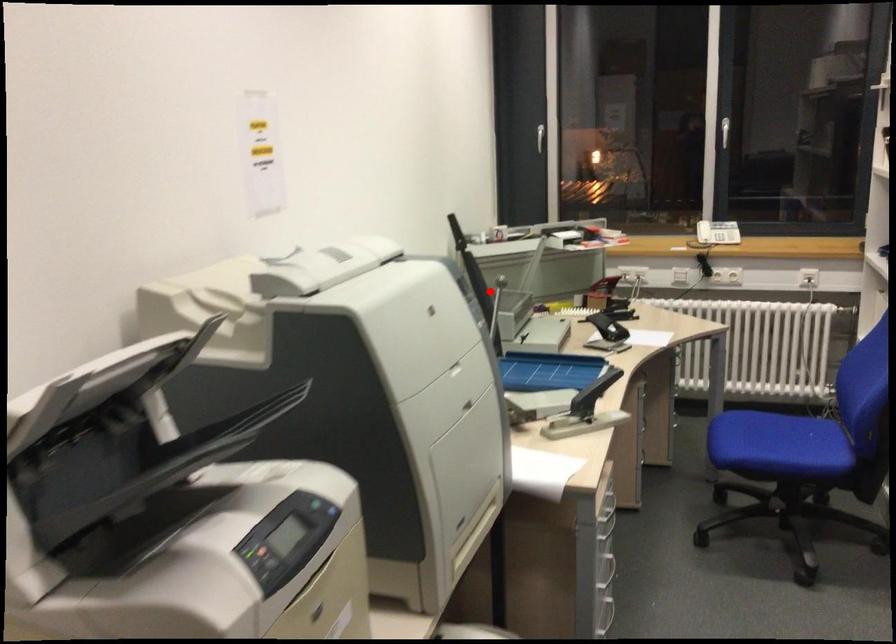
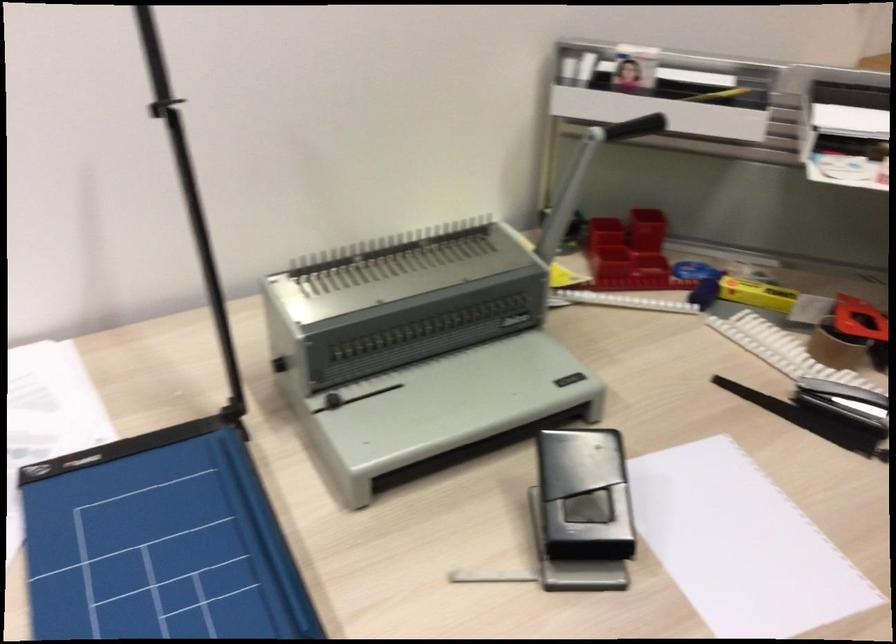
Question: I am providing you with two images of the same scene from different viewpoints. A red point is marked on the first image. Can you still see the location of the red point in image 2?

Choices:
 (A) Yes
 (B) No

Answer: (B)